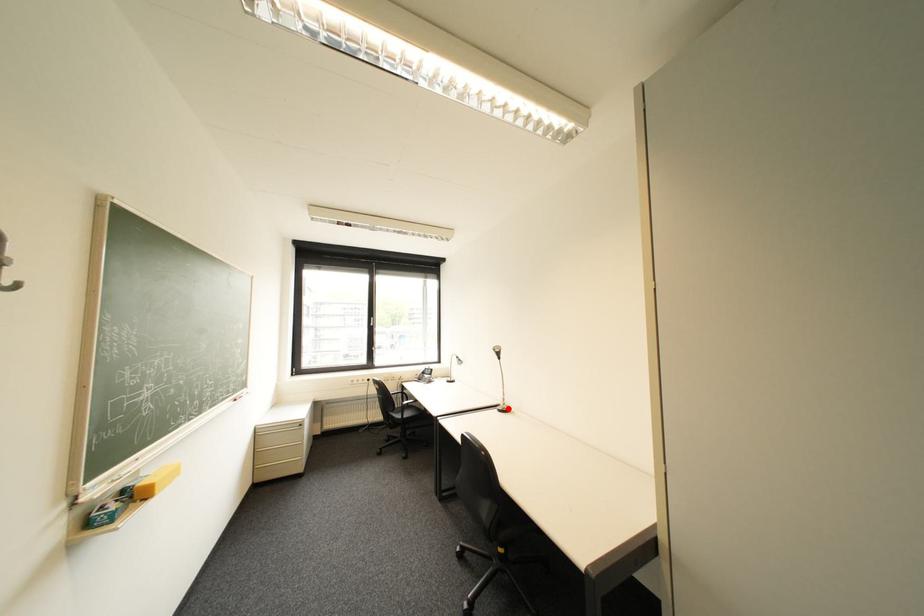
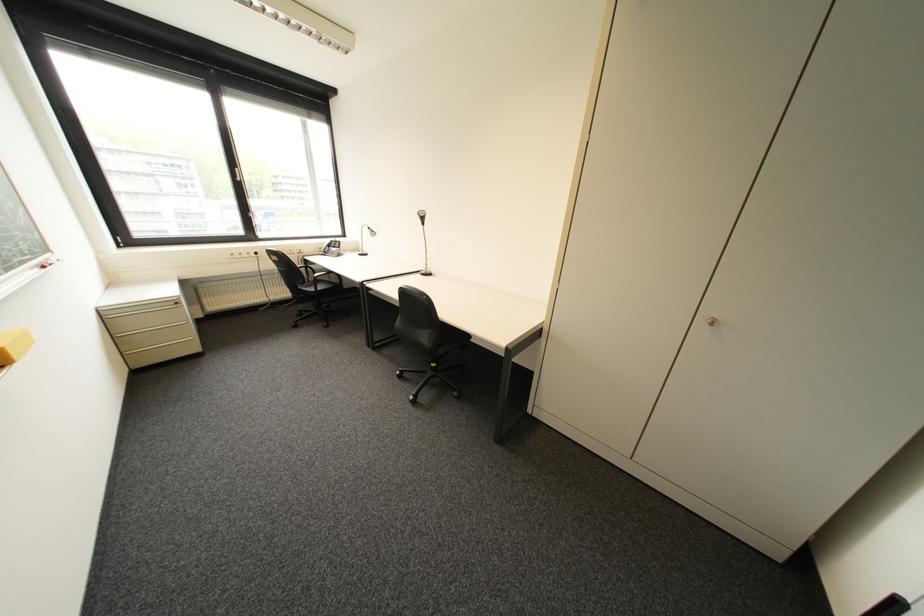
The point at the highlighted location is marked in the first image. Where is the corresponding point in the second image?

(432, 273)